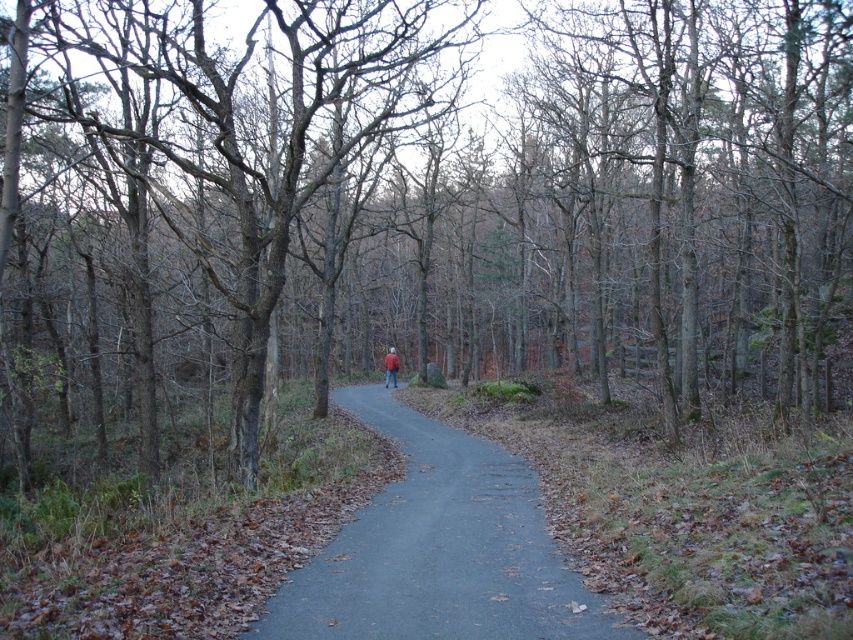
You are planning to walk along the smooth asphalt path at center while wearing the red jacket at center. Considering their sizes, which item takes up more space in the scene?

The red jacket at center takes up more space in the scene compared to the smooth asphalt path at center, as the path is described as having a smaller size.

You are standing in the forest and see the smooth asphalt path at center and the red jacket at center. Which object is positioned more to the left?

The red jacket at center is positioned more to the left than the smooth asphalt path at center.